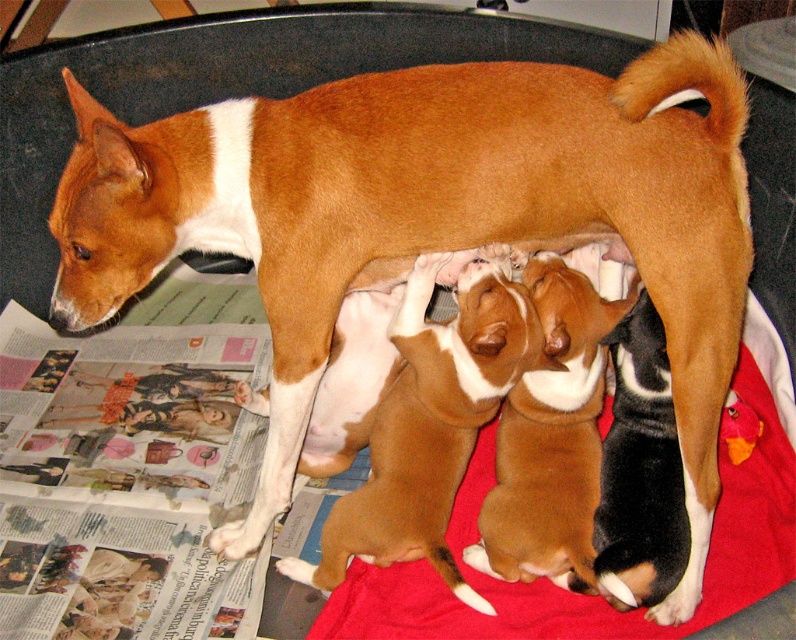
Can you confirm if brown soft fur puppies at center is smaller than brown fur puppies at center?

Actually, brown soft fur puppies at center might be larger than brown fur puppies at center.

Is brown soft fur puppies at center closer to the viewer compared to brown fur puppies at center?

That is True.

Locate an element on the screen. Image resolution: width=796 pixels, height=640 pixels. brown soft fur puppies at center is located at coordinates (430, 424).

I want to click on brown soft fur puppies at center, so click(x=430, y=424).

Who is positioned more to the right, red fabric blanket at center or brown soft fur puppies at center?

red fabric blanket at center

Locate an element on the screen. This screenshot has width=796, height=640. red fabric blanket at center is located at coordinates (587, 595).

The image size is (796, 640). Identify the location of red fabric blanket at center. (587, 595).

Is red fabric blanket at center taller than brown fur puppies at center?

No.

Does point (718, 570) come farther from viewer compared to point (578, 579)?

Yes, it is.

At what (x,y) coordinates should I click in order to perform the action: click on red fabric blanket at center. Please return your answer as a coordinate pair (x, y). Looking at the image, I should click on (587, 595).